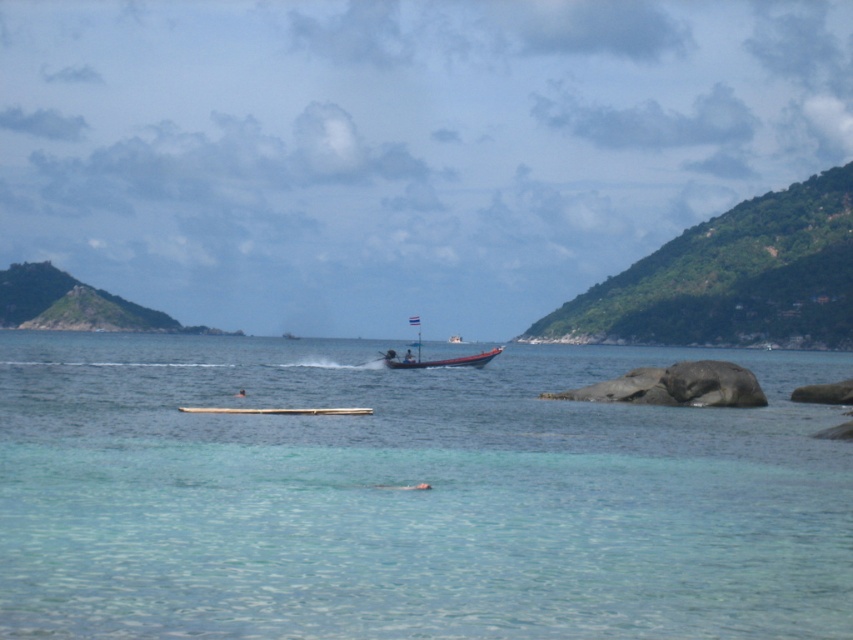
You are planning to take a boat ride and need to choose between the wooden boat at center and the red plastic boat at center. Which one can accommodate more passengers?

The wooden boat at center has a larger size compared to the red plastic boat at center, so it can accommodate more passengers.

You are planning to board a boat that can only accommodate passengers up to a height of 1.5 meters. Based on the image, which boat between the wooden boat at center and the red plastic boat at center would you choose to ensure your safety?

The wooden boat at center is much taller as red plastic boat at center, so it is safer to choose the red plastic boat at center since it has a lower height and meets the height requirement of 1.5 meters.